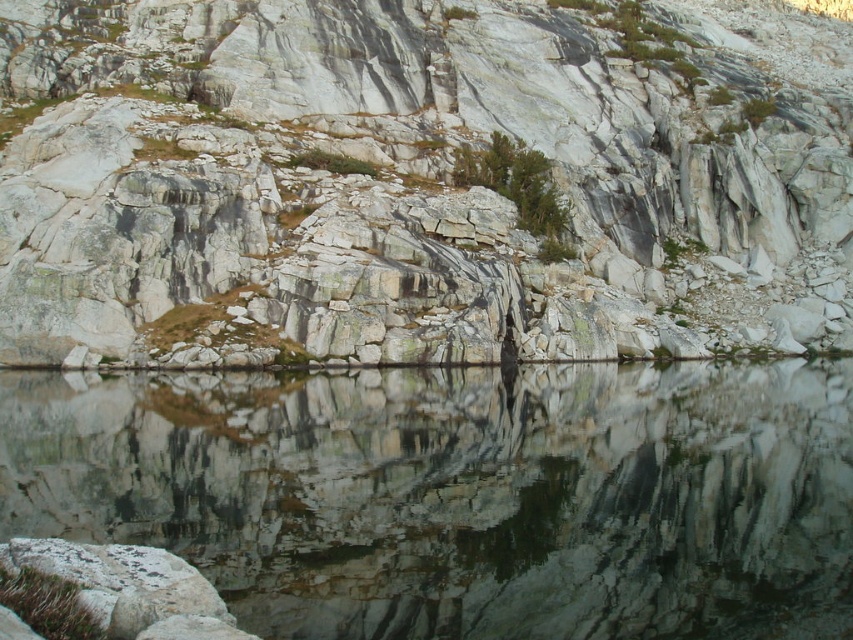
What do you see at coordinates (397, 172) in the screenshot? The width and height of the screenshot is (853, 640). I see `granite rock at center` at bounding box center [397, 172].

Identify the location of granite rock at center. 397,172.